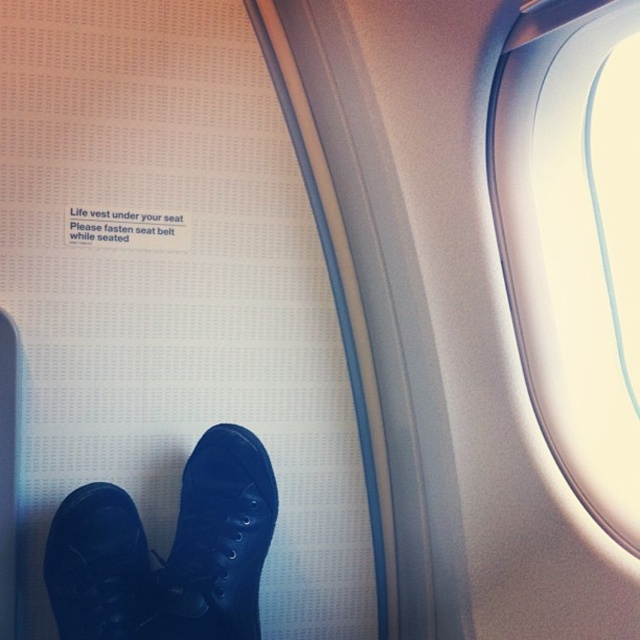
Who is positioned more to the left, black canvas shoe at lower center or black leather shoe at lower left?

From the viewer's perspective, black leather shoe at lower left appears more on the left side.

Does black canvas shoe at lower center appear under black leather shoe at lower left?

Actually, black canvas shoe at lower center is above black leather shoe at lower left.

Identify the location of black canvas shoe at lower center. The image size is (640, 640). (218, 541).

Which of these two, transparent glass airplane window at upper right or black canvas shoe at lower center, stands shorter?

black canvas shoe at lower center

Who is lower down, transparent glass airplane window at upper right or black canvas shoe at lower center?

black canvas shoe at lower center is below.

Between point (536, 109) and point (227, 600), which one is positioned in front?

Point (536, 109) is more forward.

Identify the location of transparent glass airplane window at upper right. This screenshot has height=640, width=640. (573, 237).

This screenshot has width=640, height=640. I want to click on transparent glass airplane window at upper right, so click(x=573, y=237).

Does transparent glass airplane window at upper right have a greater width compared to black leather shoe at lower left?

Yes, transparent glass airplane window at upper right is wider than black leather shoe at lower left.

This screenshot has width=640, height=640. I want to click on transparent glass airplane window at upper right, so click(x=573, y=237).